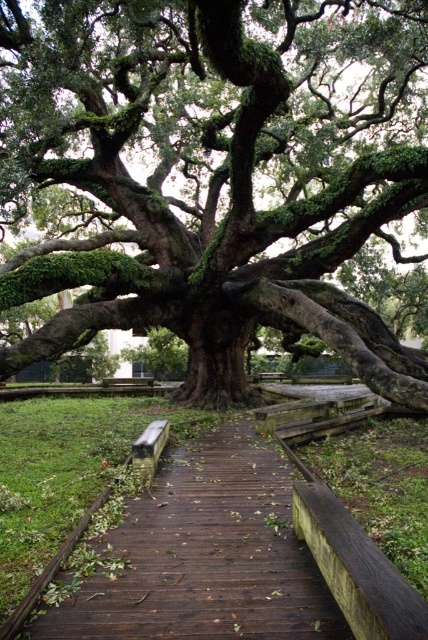
Question: Which point is closer to the camera?

Choices:
 (A) brown wooden path at center
 (B) wooden park bench at center

Answer: (A)

Question: Does green mossy oak tree at center lie in front of brown wooden path at center?

Choices:
 (A) no
 (B) yes

Answer: (A)

Question: Which of the following is the farthest from the observer?

Choices:
 (A) brown wooden path at center
 (B) green mossy oak tree at center

Answer: (B)

Question: Is brown wooden path at center above wooden park bench at center?

Choices:
 (A) yes
 (B) no

Answer: (B)

Question: Does brown wooden path at center appear under wooden park bench at center?

Choices:
 (A) yes
 (B) no

Answer: (A)

Question: Which point is farther to the camera?

Choices:
 (A) (151, 444)
 (B) (193, 147)

Answer: (B)